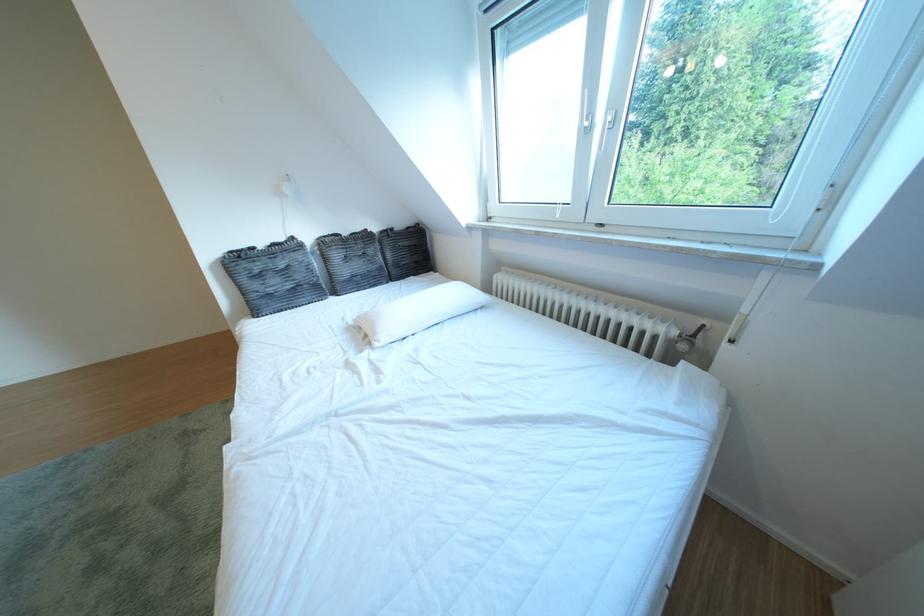
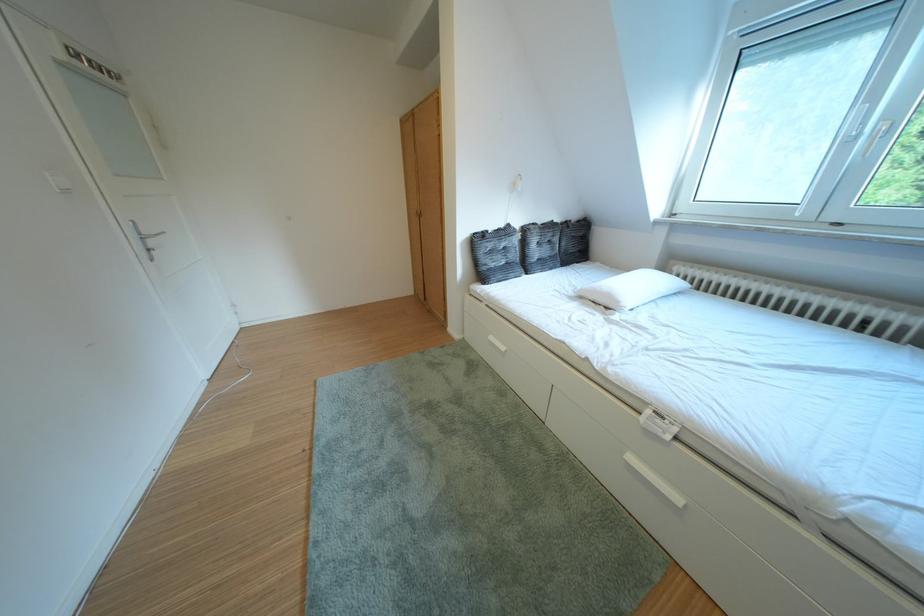
Locate, in the second image, the point that corresponds to point 307,243 in the first image.

(523, 230)